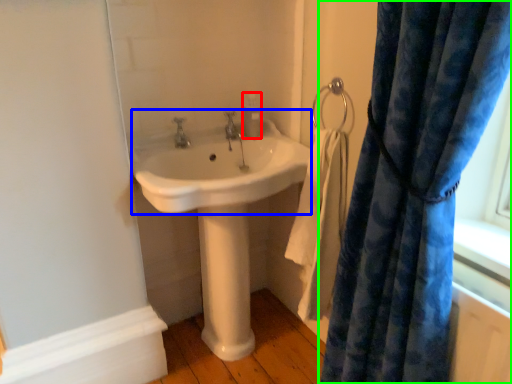
Question: Estimate the real-world distances between objects in this image. Which object is farther from soap dispenser (highlighted by a red box), sink (highlighted by a blue box) or curtain (highlighted by a green box)?

Choices:
 (A) sink
 (B) curtain

Answer: (B)